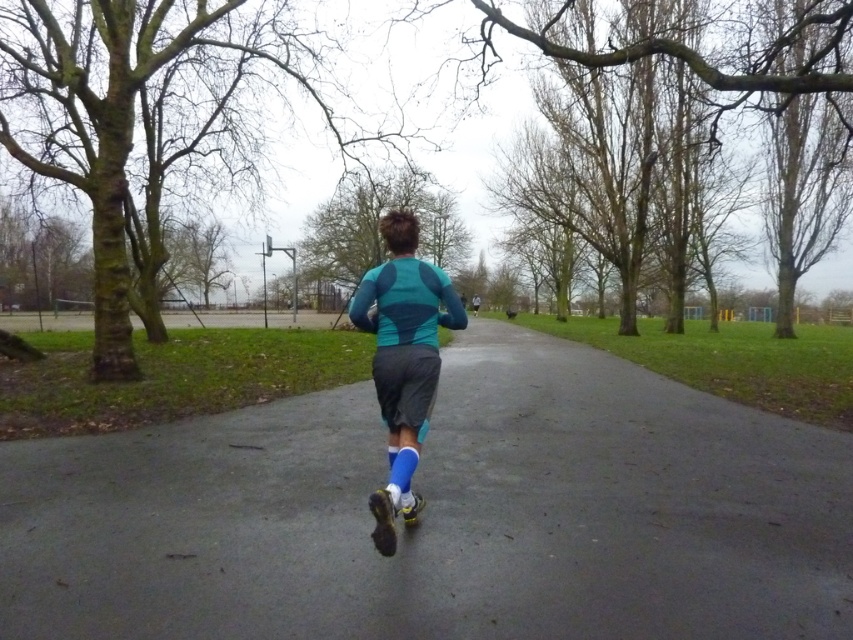
Based on the photo, you are a delivery robot with a width of 1.5 meters. You need to deliver a package to the person wearing the teal matte athletic top at center. The smooth asphalt path at center is the only path available. Can you navigate safely to deliver the package without hitting the person?

Result: The smooth asphalt path at center and teal matte athletic top at center are 1.91 meters apart. Since the robot is 1.5 meters wide, there is enough space between the path and the person to navigate safely and deliver the package without collision.

You are a runner preparing to jog along the smooth asphalt path at center. You notice the teal matte athletic top at center worn by another runner ahead of you. Which object is closer to you, the path or the top?

The teal matte athletic top at center is closer to you than the smooth asphalt path at center because the path is shorter than the top.